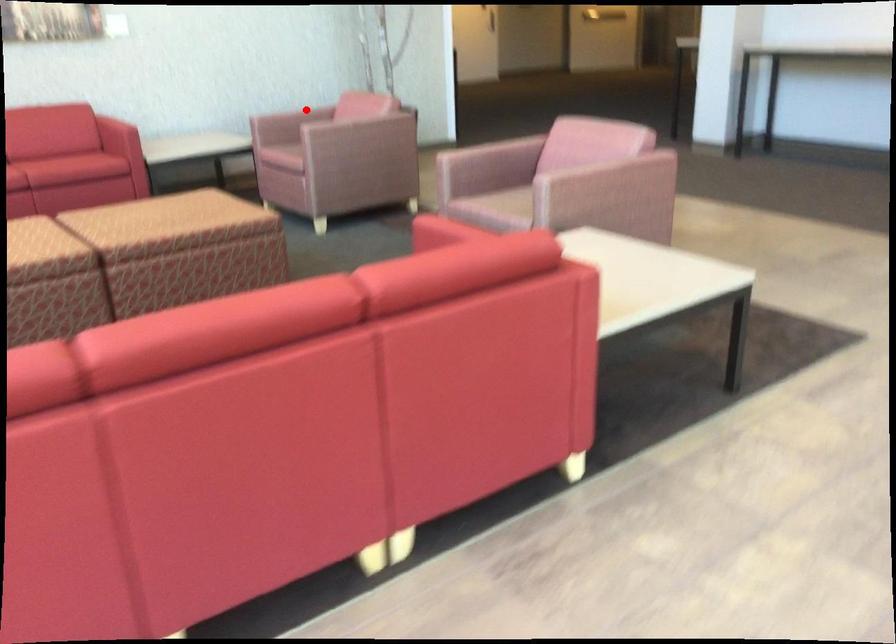
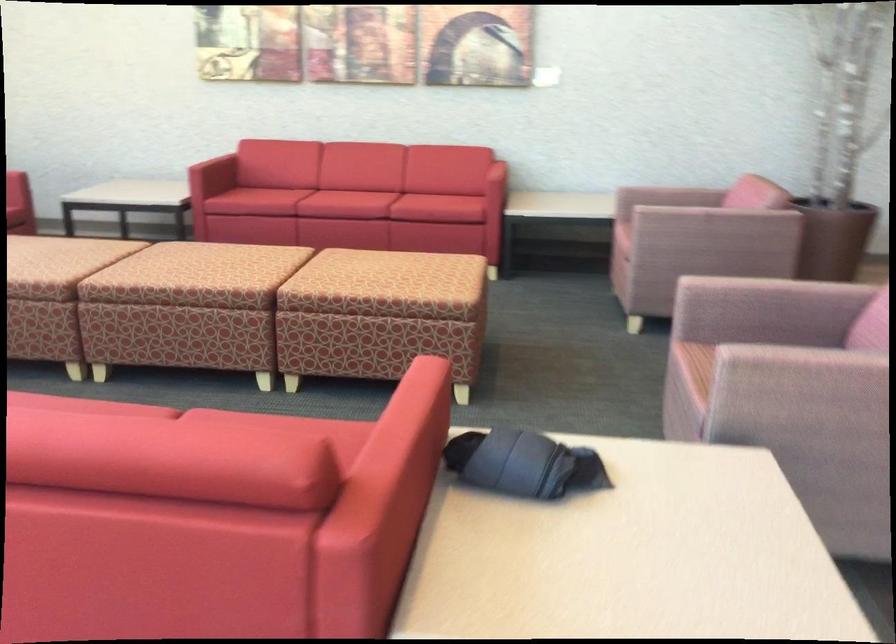
Locate, in the second image, the point that corresponds to the highlighted location in the first image.

(669, 196)